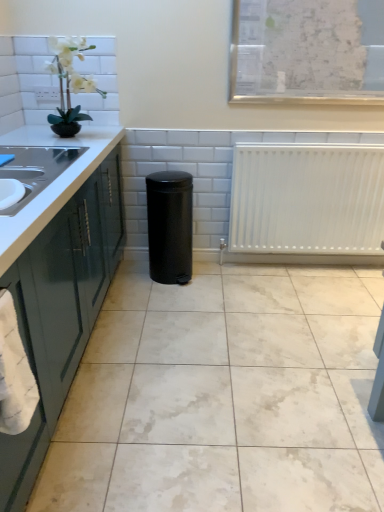
Question: Does white glossy countertop at left, which ranks as the first countertop in bottom-to-top order, lie in front of black matte trash can at center?

Choices:
 (A) yes
 (B) no

Answer: (A)

Question: Can you confirm if white glossy countertop at left, which ranks as the first countertop in bottom-to-top order, is thinner than black matte trash can at center?

Choices:
 (A) yes
 (B) no

Answer: (B)

Question: Is white glossy countertop at left, which ranks as the first countertop in bottom-to-top order, completely or partially outside of black matte trash can at center?

Choices:
 (A) yes
 (B) no

Answer: (A)

Question: Considering the relative sizes of white glossy countertop at left, the second countertop positioned from the top, and black matte trash can at center in the image provided, is white glossy countertop at left, the second countertop positioned from the top, bigger than black matte trash can at center?

Choices:
 (A) no
 (B) yes

Answer: (B)

Question: From a real-world perspective, is white glossy countertop at left, which ranks as the first countertop in bottom-to-top order, on top of black matte trash can at center?

Choices:
 (A) yes
 (B) no

Answer: (A)

Question: Is white matte orchid at upper left in front of or behind black matte trash can at center in the image?

Choices:
 (A) behind
 (B) front

Answer: (B)

Question: Considering the positions of white matte orchid at upper left and black matte trash can at center in the image, is white matte orchid at upper left bigger or smaller than black matte trash can at center?

Choices:
 (A) big
 (B) small

Answer: (B)

Question: From the image's perspective, is white matte orchid at upper left located above or below black matte trash can at center?

Choices:
 (A) below
 (B) above

Answer: (B)

Question: From a real-world perspective, relative to black matte trash can at center, is white matte orchid at upper left vertically above or below?

Choices:
 (A) above
 (B) below

Answer: (A)

Question: Considering the positions of point (36, 418) and point (172, 233), is point (36, 418) closer or farther from the camera than point (172, 233)?

Choices:
 (A) closer
 (B) farther

Answer: (A)

Question: From a real-world perspective, is white glossy countertop at left, the second countertop positioned from the top, above or below black matte trash can at center?

Choices:
 (A) above
 (B) below

Answer: (A)

Question: Would you say white glossy countertop at left, the second countertop positioned from the top, is inside or outside black matte trash can at center?

Choices:
 (A) inside
 (B) outside

Answer: (B)

Question: Considering the positions of white glossy countertop at left, which ranks as the first countertop in bottom-to-top order, and black matte trash can at center in the image, is white glossy countertop at left, which ranks as the first countertop in bottom-to-top order, wider or thinner than black matte trash can at center?

Choices:
 (A) wide
 (B) thin

Answer: (A)

Question: In the image, is black matte trash can at center positioned in front of or behind white glossy countertop at left, the second countertop positioned from the top?

Choices:
 (A) behind
 (B) front

Answer: (A)

Question: Considering the positions of black matte trash can at center and white glossy countertop at left, the second countertop positioned from the top, in the image, is black matte trash can at center taller or shorter than white glossy countertop at left, the second countertop positioned from the top,?

Choices:
 (A) tall
 (B) short

Answer: (B)